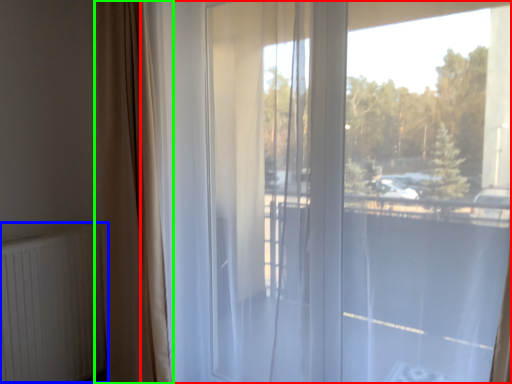
Question: Estimate the real-world distances between objects in this image. Which object is closer to window (highlighted by a red box), radiator (highlighted by a blue box) or curtain (highlighted by a green box)?

Choices:
 (A) radiator
 (B) curtain

Answer: (B)